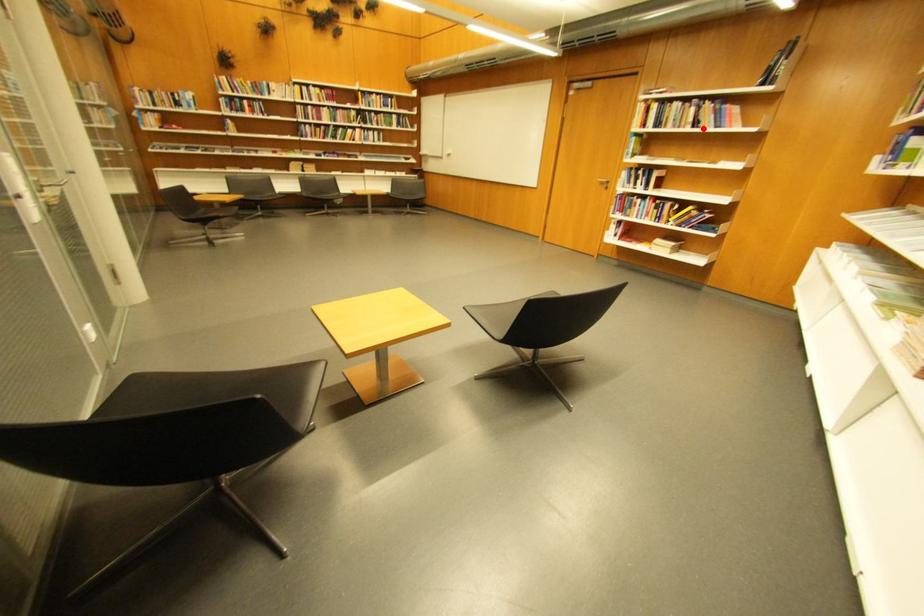
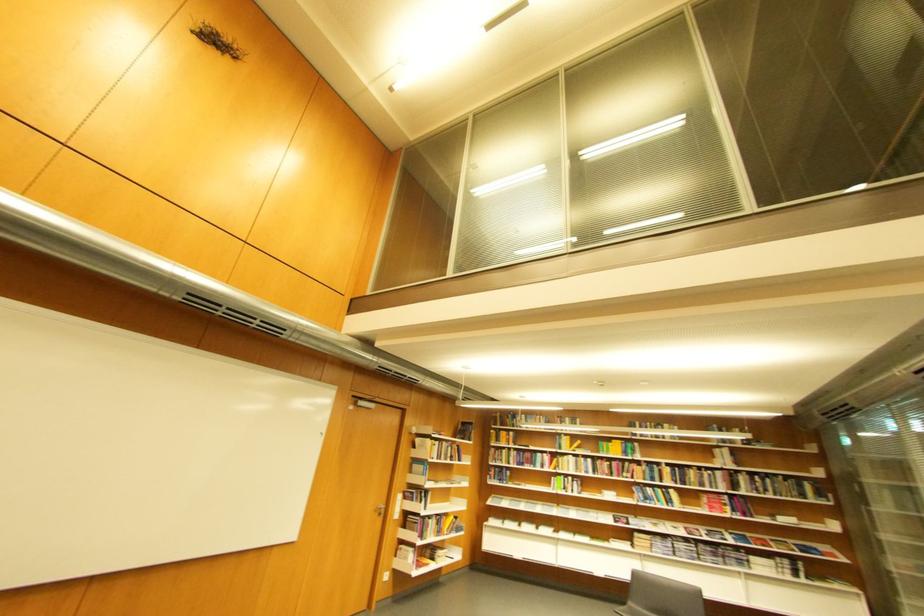
Locate, in the second image, the point that corresponds to the highlighted location in the first image.

(460, 461)